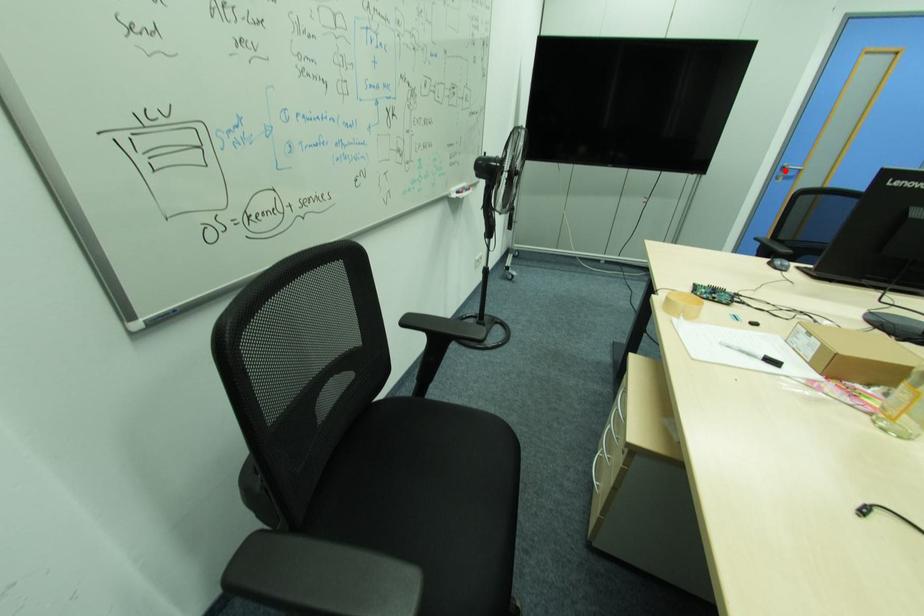
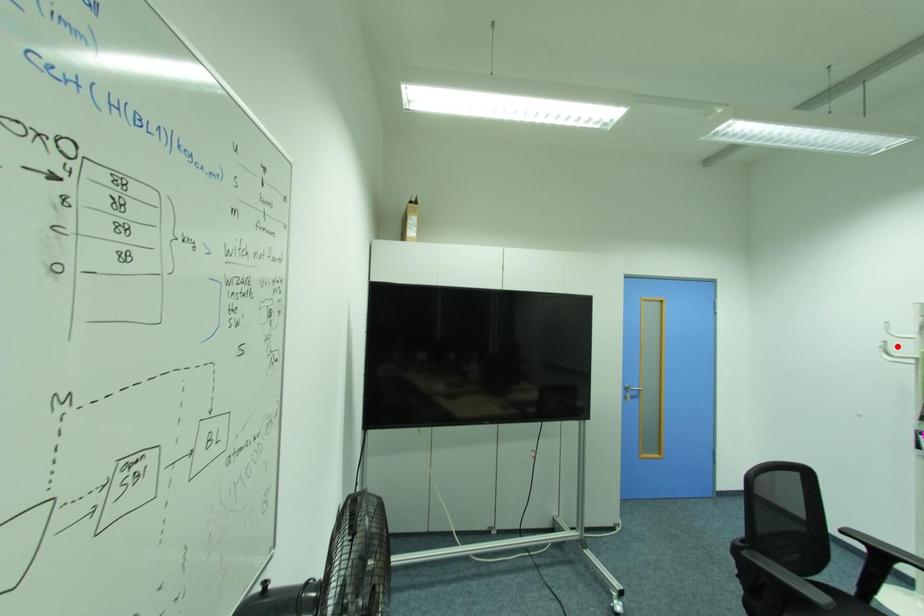
I am providing you with two images of the same scene from different viewpoints. A red point is marked on the first image and another point is marked on the second image. Are the points marked in image1 and image2 representing the same 3D position?

No